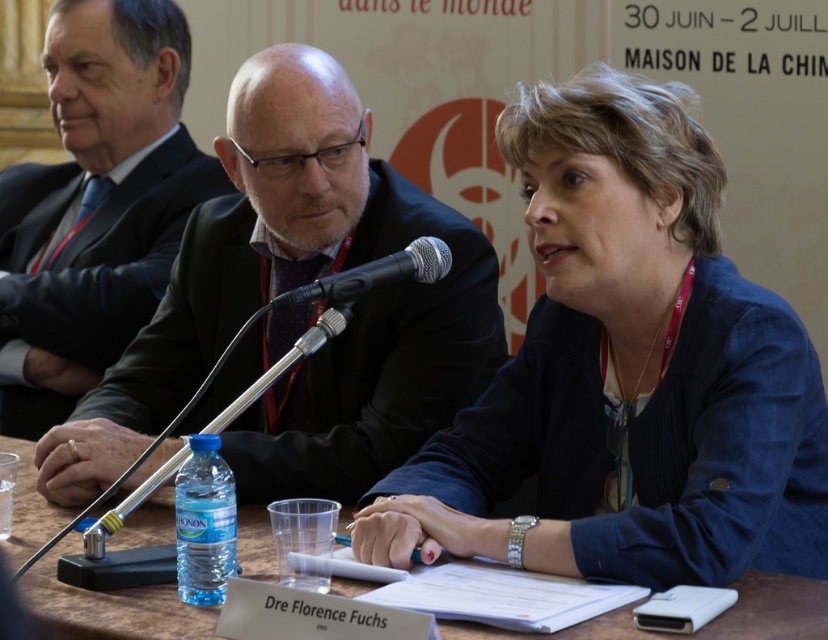
You are organizing a conference and need to ensure that the matte black suit at center and the brown wooden table at center can fit through a doorway that is 1.2 meters wide. Based on their widths, will both items fit through the doorway when moved individually?

The matte black suit at center is wider than the brown wooden table at center. Since the doorway is 1.2 meters wide, both items can fit individually as long as their widths are less than 1.2 meters. However, without specific measurements, we cannot confirm if they individually meet the requirement. The provided information only states the relative widths between the two objects.

You are organizing a photo shoot and need to ensure that the blue fabric jacket at center and the dark suit at center are visible in the frame. Given that the camera has a fixed width, which object should you prioritize positioning closer to the center to ensure both are fully visible?

The blue fabric jacket at center has a larger width than the dark suit at center. To ensure both are fully visible, prioritize positioning the blue fabric jacket at center closer to the center of the frame since it requires more space.